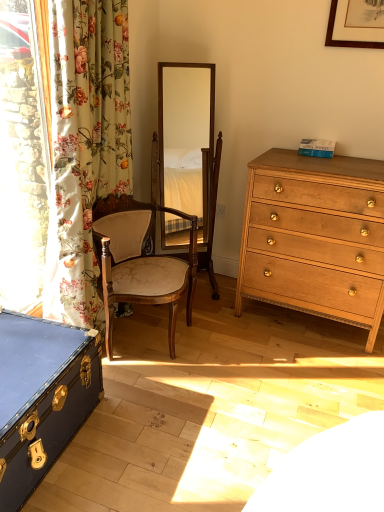
Question: Is floral fabric curtain at left shorter than wooden swivel chair at center?

Choices:
 (A) no
 (B) yes

Answer: (A)

Question: Is floral fabric curtain at left positioned far away from wooden swivel chair at center?

Choices:
 (A) no
 (B) yes

Answer: (A)

Question: Is floral fabric curtain at left oriented towards wooden swivel chair at center?

Choices:
 (A) no
 (B) yes

Answer: (A)

Question: Considering the relative sizes of floral fabric curtain at left and wooden swivel chair at center in the image provided, is floral fabric curtain at left thinner than wooden swivel chair at center?

Choices:
 (A) no
 (B) yes

Answer: (B)

Question: From the image's perspective, does floral fabric curtain at left appear lower than wooden swivel chair at center?

Choices:
 (A) yes
 (B) no

Answer: (A)

Question: Considering the relative sizes of floral fabric curtain at left and wooden swivel chair at center in the image provided, is floral fabric curtain at left smaller than wooden swivel chair at center?

Choices:
 (A) no
 (B) yes

Answer: (A)

Question: Are blue leather trunk at lower left and floral fabric curtain at left making contact?

Choices:
 (A) no
 (B) yes

Answer: (A)

Question: Is blue leather trunk at lower left closer to the viewer compared to floral fabric curtain at left?

Choices:
 (A) yes
 (B) no

Answer: (A)

Question: From a real-world perspective, does blue leather trunk at lower left sit lower than floral fabric curtain at left?

Choices:
 (A) no
 (B) yes

Answer: (B)

Question: From the image's perspective, is blue leather trunk at lower left on floral fabric curtain at left?

Choices:
 (A) yes
 (B) no

Answer: (B)

Question: Is blue leather trunk at lower left positioned beyond the bounds of floral fabric curtain at left?

Choices:
 (A) no
 (B) yes

Answer: (B)

Question: Is blue leather trunk at lower left smaller than floral fabric curtain at left?

Choices:
 (A) yes
 (B) no

Answer: (A)

Question: Is white plastic power outlet at center turned away from floral fabric curtain at left?

Choices:
 (A) yes
 (B) no

Answer: (B)